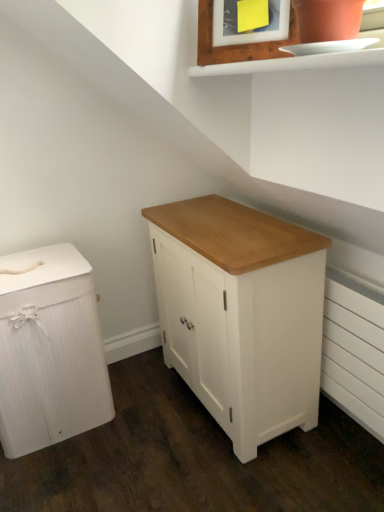
I want to click on free space above white painted radiator at lower right (from a real-world perspective), so click(348, 283).